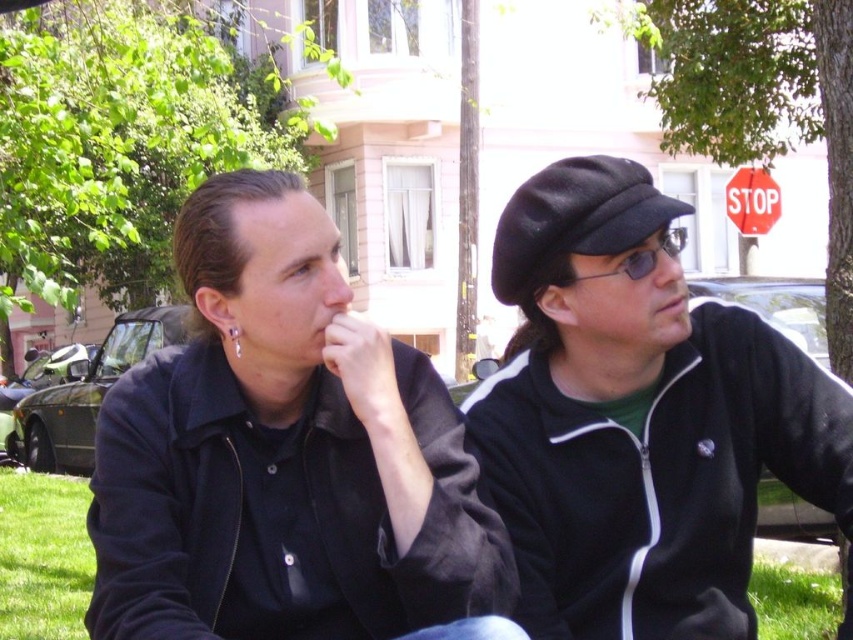
Question: Does black matte cap at upper right lie in front of green grass at lower left?

Choices:
 (A) no
 (B) yes

Answer: (B)

Question: Among these objects, which one is nearest to the camera?

Choices:
 (A) green grass at lower right
 (B) green grass at lower left

Answer: (A)

Question: Which point is closer to the camera?

Choices:
 (A) green grass at lower right
 (B) red plastic stop sign at upper right

Answer: (A)

Question: Is green grass at lower right thinner than red plastic stop sign at upper right?

Choices:
 (A) yes
 (B) no

Answer: (B)

Question: Is green grass at lower right wider than red plastic stop sign at upper right?

Choices:
 (A) yes
 (B) no

Answer: (A)

Question: Which of the following is the farthest from the observer?

Choices:
 (A) black matte cap at upper right
 (B) black matte jacket at left
 (C) red plastic stop sign at upper right
 (D) green grass at lower right

Answer: (C)